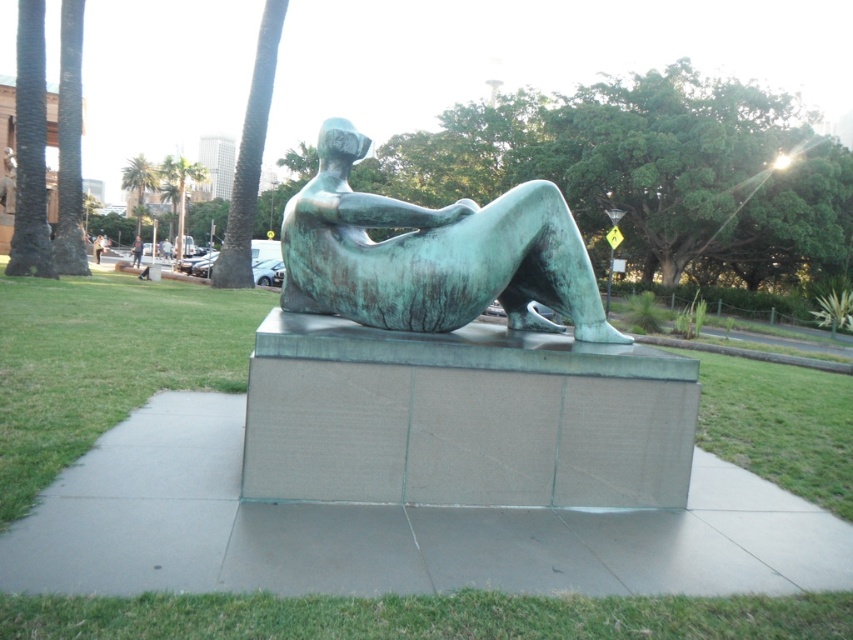
You are standing directly in front of the bronze sculpture on the paved platform. Looking towards the green leafy palm tree at upper center, can you estimate the direction you need to turn your head to look at it?

The green leafy palm tree at upper center is located at coordinates point (138, 182), so you would need to turn your head slightly to the left and upwards to look at it.

You are planning to install a new lighting fixture that needs to be placed between the green leafy palm tree at upper center and the green textured palm tree at upper left. Based on their heights, which tree should the light be anchored to for better visibility?

The green textured palm tree at upper left is taller than the green leafy palm tree at upper center, so anchoring the light to the taller green textured palm tree at upper left would provide better visibility.